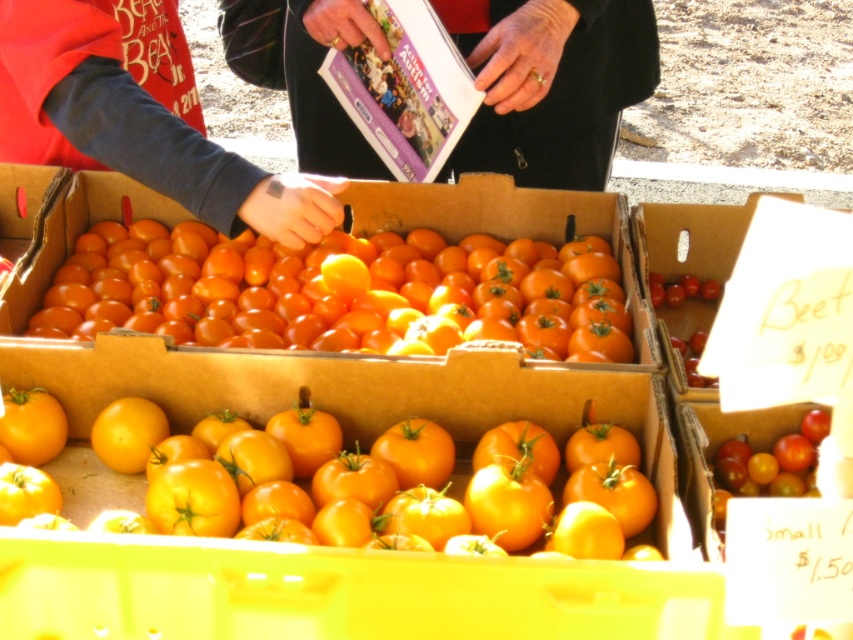
Does yellow matte tomato at center appear on the right side of matte black jacket at upper left?

Yes, yellow matte tomato at center is to the right of matte black jacket at upper left.

The width and height of the screenshot is (853, 640). Find the location of `yellow matte tomato at center`. yellow matte tomato at center is located at coordinates (369, 486).

How distant is yellow matte tomato at center from smooth cardboard box at upper center?

28.61 inches

In the scene shown: Does yellow matte tomato at center have a smaller size compared to smooth cardboard box at upper center?

Indeed, yellow matte tomato at center has a smaller size compared to smooth cardboard box at upper center.

You are a GUI agent. You are given a task and a screenshot of the screen. Output one action in this format:
    pyautogui.click(x=<x>, y=<y>)
    Task: Click on the yellow matte tomato at center
    The image size is (853, 640).
    Given the screenshot: What is the action you would take?
    pyautogui.click(x=369, y=486)

Who is positioned more to the right, smooth cardboard box at upper center or matte black jacket at upper left?

smooth cardboard box at upper center is more to the right.

Locate an element on the screen. The width and height of the screenshot is (853, 640). smooth cardboard box at upper center is located at coordinates (550, 84).

Locate an element on the screen. Image resolution: width=853 pixels, height=640 pixels. smooth cardboard box at upper center is located at coordinates (550, 84).

Where is `smooth cardboard box at upper center`? smooth cardboard box at upper center is located at coordinates (550, 84).